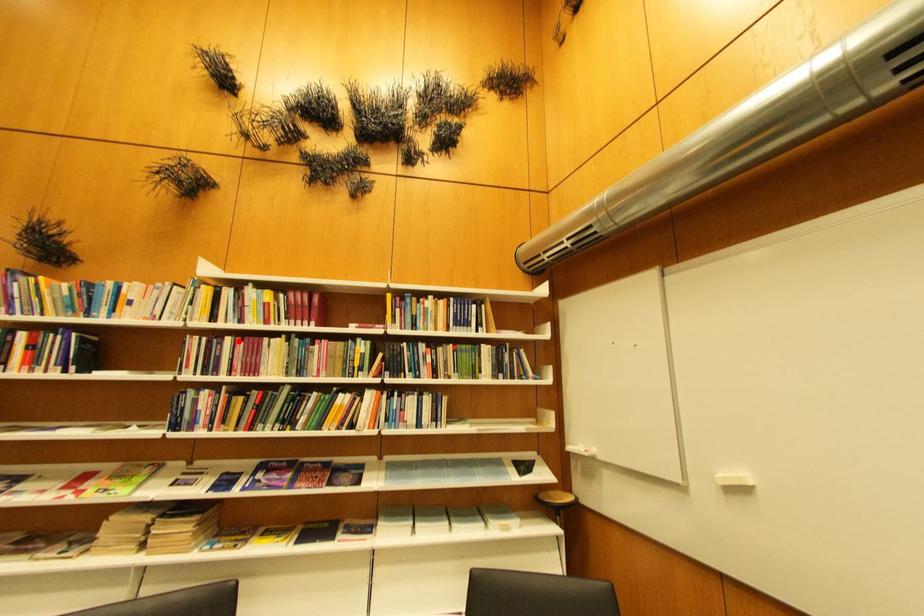
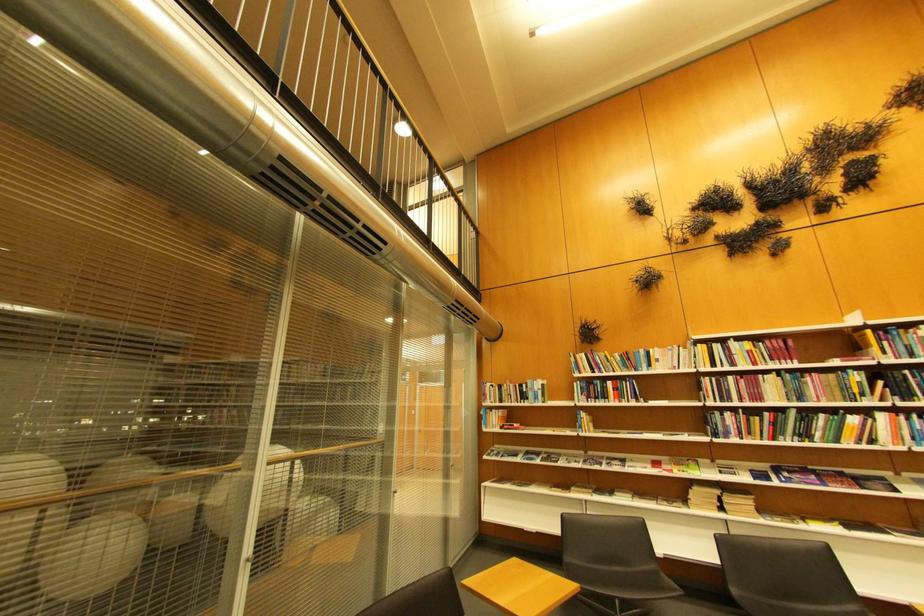
Find the pixel in the second image that matches the highlighted location in the first image.

(740, 379)